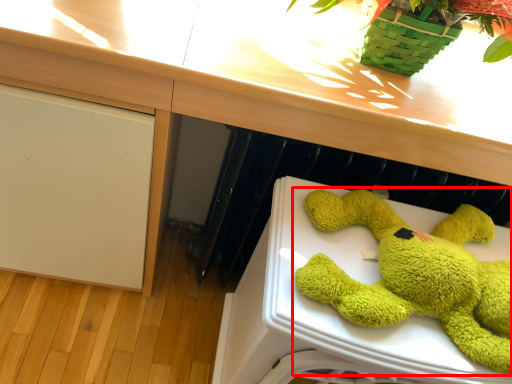
Question: From the image, what is the correct spatial relationship of toy (annotated by the red box) in relation to counter top?

Choices:
 (A) left
 (B) right

Answer: (B)